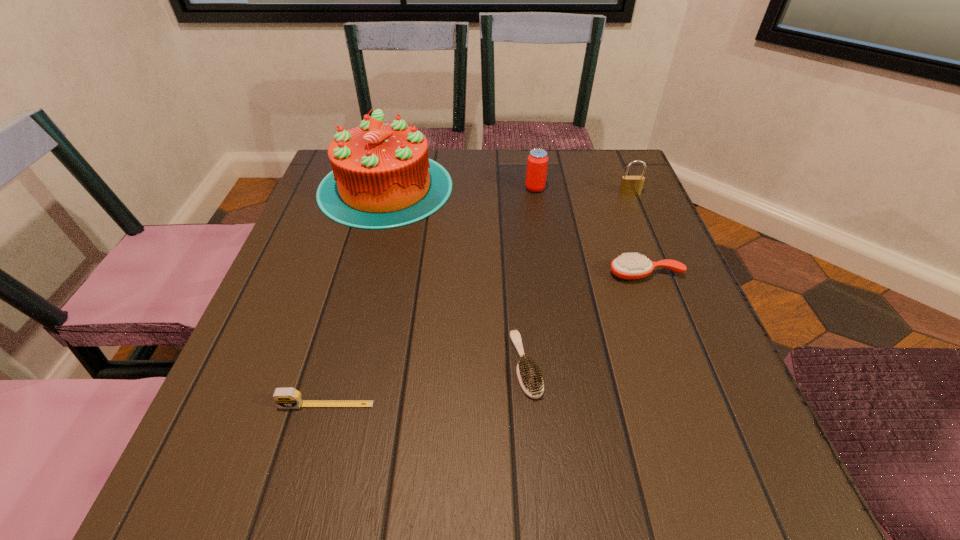
The height and width of the screenshot is (540, 960). I want to click on object that is at the far left corner, so coord(382,177).

You are a GUI agent. You are given a task and a screenshot of the screen. Output one action in this format:
    pyautogui.click(x=<x>, y=<y>)
    Task: Click on the object positioned at the far right corner
    The width and height of the screenshot is (960, 540).
    Given the screenshot: What is the action you would take?
    pyautogui.click(x=630, y=185)

This screenshot has height=540, width=960. In order to click on vacant area at the far edge in this screenshot , I will do `click(506, 155)`.

I want to click on free space at the near edge of the desktop, so click(392, 458).

Locate an element on the screen. free space at the left edge is located at coordinates click(218, 435).

Locate an element on the screen. vacant point at the right edge is located at coordinates (644, 359).

This screenshot has width=960, height=540. I want to click on vacant region at the near left corner of the desktop, so click(271, 478).

In the image, there is a desktop. What are the coordinates of `vacant region at the near right corner` in the screenshot? It's located at (766, 514).

The width and height of the screenshot is (960, 540). Identify the location of free space between the third nearest object and the beer can. (590, 231).

Find the location of a particular element. The image size is (960, 540). unoccupied area between the third nearest object and the tape measure is located at coordinates (486, 339).